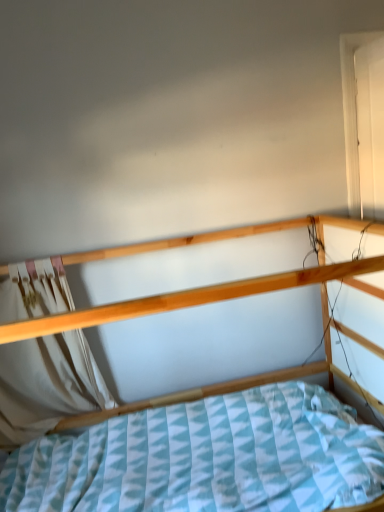
Question: Should I look upward or downward to see white wood door at upper right?

Choices:
 (A) up
 (B) down

Answer: (A)

Question: Can you confirm if white fabric curtain at left is wider than white wood door at upper right?

Choices:
 (A) no
 (B) yes

Answer: (A)

Question: Considering the relative sizes of white fabric curtain at left and white wood door at upper right in the image provided, is white fabric curtain at left bigger than white wood door at upper right?

Choices:
 (A) no
 (B) yes

Answer: (B)

Question: Considering the relative sizes of white fabric curtain at left and white wood door at upper right in the image provided, is white fabric curtain at left thinner than white wood door at upper right?

Choices:
 (A) yes
 (B) no

Answer: (A)

Question: From the image's perspective, is white fabric curtain at left located beneath white wood door at upper right?

Choices:
 (A) yes
 (B) no

Answer: (A)

Question: Is white fabric curtain at left aimed at white wood door at upper right?

Choices:
 (A) no
 (B) yes

Answer: (A)

Question: Can you confirm if white fabric curtain at left is smaller than white wood door at upper right?

Choices:
 (A) yes
 (B) no

Answer: (B)

Question: Does wooden bed at center lie in front of white fabric curtain at left?

Choices:
 (A) yes
 (B) no

Answer: (A)

Question: From a real-world perspective, is wooden bed at center beneath white fabric curtain at left?

Choices:
 (A) no
 (B) yes

Answer: (B)

Question: Does wooden bed at center have a larger size compared to white fabric curtain at left?

Choices:
 (A) no
 (B) yes

Answer: (B)

Question: Is wooden bed at center completely or partially outside of white fabric curtain at left?

Choices:
 (A) yes
 (B) no

Answer: (A)

Question: Can you confirm if wooden bed at center is taller than white fabric curtain at left?

Choices:
 (A) no
 (B) yes

Answer: (B)

Question: From the image's perspective, is wooden bed at center above white fabric curtain at left?

Choices:
 (A) no
 (B) yes

Answer: (A)

Question: Is wooden bed at center closer to camera compared to white wood door at upper right?

Choices:
 (A) no
 (B) yes

Answer: (B)